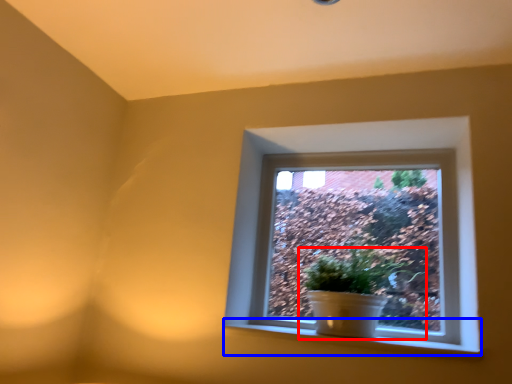
Question: Which point is closer to the camera, houseplant (highlighted by a red box) or window sill (highlighted by a blue box)?

Choices:
 (A) houseplant
 (B) window sill

Answer: (B)